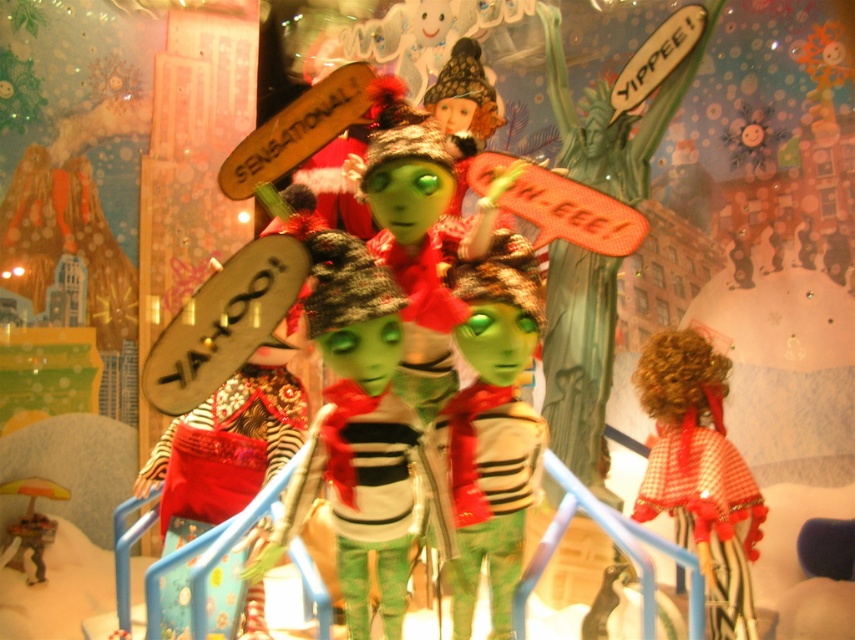
You are standing 6 feet away from the festive display. Can you see the point at coordinates point (399, 330) clearly?

The distance of point (399, 330) from viewer is 5.08 feet, so yes, you can see the point at coordinates point (399, 330) clearly since you are standing closer than 6 feet away.

You are standing in front of the festive display and want to place a small gift between the matte green doll at center and the metallic gold umbrella at lower left. Based on their positions, which object should the gift be closer to?

The gift should be closer to the metallic gold umbrella at lower left because the matte green doll at center is positioned to the right of the metallic gold umbrella at lower left.